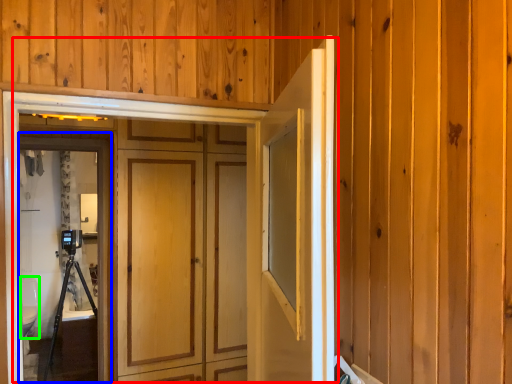
Question: Considering the real-world distances, which object is closest to door (highlighted by a red box)? screen door (highlighted by a blue box) or toilet bowl (highlighted by a green box).

Choices:
 (A) screen door
 (B) toilet bowl

Answer: (A)